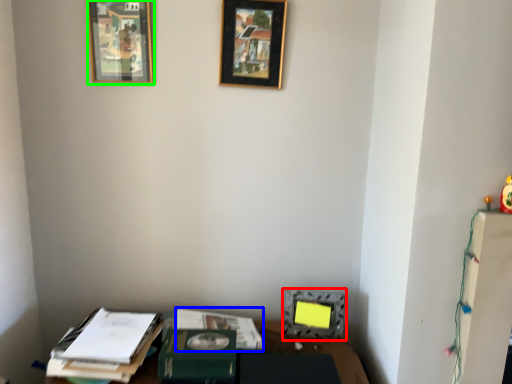
Question: Considering the real-world distances, which object is closest to picture frame (highlighted by a red box)? journal (highlighted by a blue box) or picture frame (highlighted by a green box).

Choices:
 (A) journal
 (B) picture frame

Answer: (A)